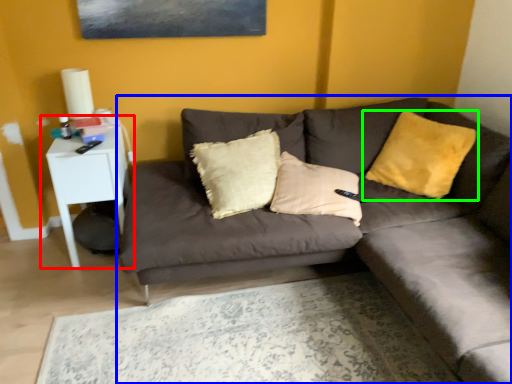
Question: Considering the real-world distances, which object is closest to table (highlighted by a red box)? studio couch (highlighted by a blue box) or pillow (highlighted by a green box).

Choices:
 (A) studio couch
 (B) pillow

Answer: (A)